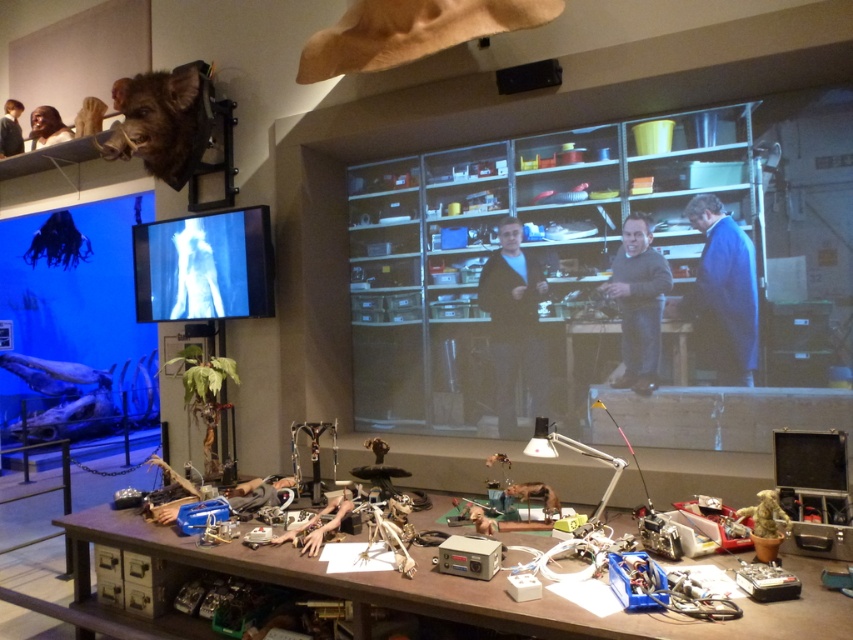
You are setting up a new monitor for a project. You have a monitor that is 40 inches wide. You need to place it on the wooden table at center or hang it on the matte black screen at center. Based on their widths, which location can accommodate the monitor?

The wooden table at center is wider than the matte black screen at center, so the monitor should be placed on the wooden table at center.